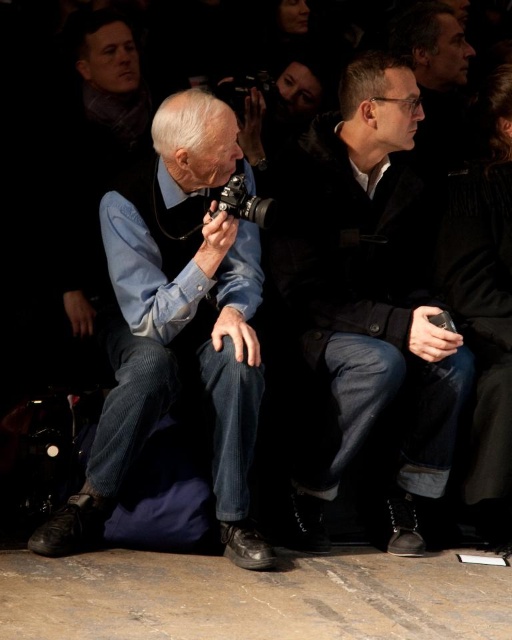
You are organizing a photo shoot and need to place the silver metallic camera at center on top of the denim jeans at center. Considering their sizes, will the camera fit without hanging off the edge?

The denim jeans at center has a larger size compared to silver metallic camera at center, so the camera will fit without hanging off the edge since the jeans are bigger.

You are a photographer at the event and want to place your matte black camera at center and denim jeans at center on a small table that can only fit one item. Which item should you choose to place on the table based on their size?

The denim jeans at center are narrower than the matte black camera at center, so you should place the denim jeans at center on the table since it takes up less space.